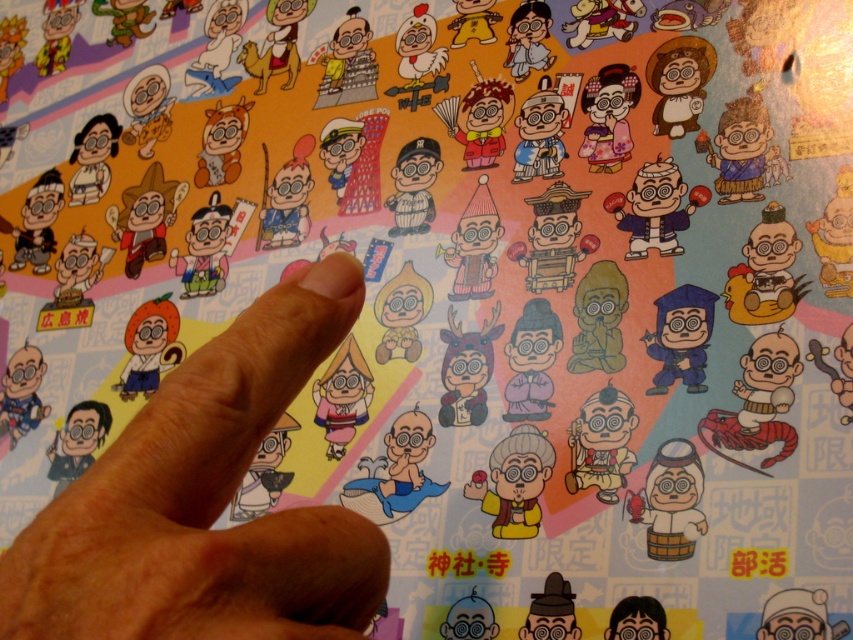
Looking at the image, there are two elements I need to compare. The first is the brown skin at center and the second is the blue matte graduation cap at lower right. Which one has a greater height?

The brown skin at center is taller than the blue matte graduation cap at lower right.

You are organizing a photo album and want to place the brown skin at center and the blue matte graduation cap at lower right side by side. Which object should you place first if you want the wider one to be on the left?

The brown skin at center is wider than the blue matte graduation cap at lower right, so you should place the brown skin at center first on the left side.